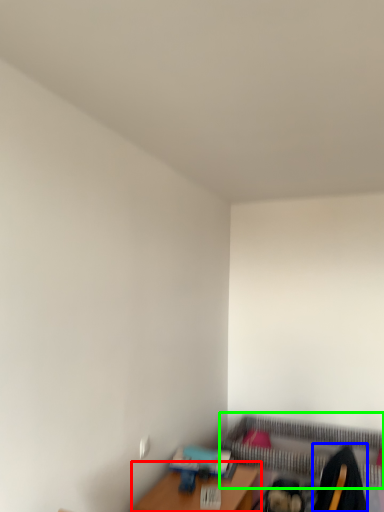
Question: Which is farther away from table (highlighted by a red box)? swivel chair (highlighted by a blue box) or bed frame (highlighted by a green box)?

Choices:
 (A) swivel chair
 (B) bed frame

Answer: (B)